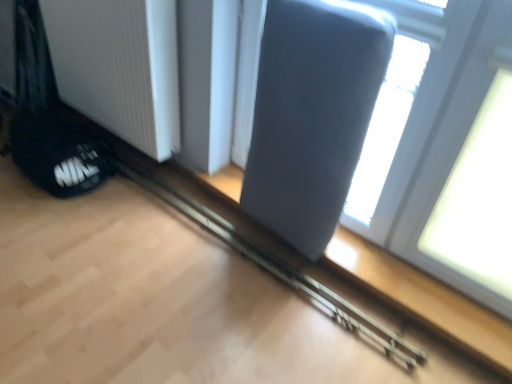
The height and width of the screenshot is (384, 512). I want to click on black mesh shoe at lower left, so click(59, 154).

In order to face black mesh shoe at lower left, should I rotate leftwards or rightwards?

Turn left by 25.802 degrees to look at black mesh shoe at lower left.

The image size is (512, 384). What do you see at coordinates (448, 151) in the screenshot? I see `matte gray cushion at upper right` at bounding box center [448, 151].

This screenshot has height=384, width=512. What do you see at coordinates (312, 114) in the screenshot? I see `suede gray swivel chair at upper right` at bounding box center [312, 114].

You are a GUI agent. You are given a task and a screenshot of the screen. Output one action in this format:
    pyautogui.click(x=<x>, y=<y>)
    Task: Click on the metallic gray rail at center
    
    Given the screenshot: What is the action you would take?
    pyautogui.click(x=275, y=265)

Locate an element on the screen. The width and height of the screenshot is (512, 384). swivel chair that appears on the right of black mesh shoe at lower left is located at coordinates (312, 114).

Consider the image. Which is more to the left, black mesh shoe at lower left or suede gray swivel chair at upper right?

black mesh shoe at lower left.

Which point is more forward, (101, 151) or (312, 75)?

The point (312, 75) is more forward.

Which is closer to the camera, (368, 335) or (422, 184)?

The point (422, 184) is closer to the camera.

Considering the sizes of objects metallic gray rail at center and matte gray cushion at upper right in the image provided, who is bigger, metallic gray rail at center or matte gray cushion at upper right?

matte gray cushion at upper right is bigger.

Is metallic gray rail at center located outside matte gray cushion at upper right?

Yes.

Locate an element on the screen. window above the metallic gray rail at center (from a real-world perspective) is located at coordinates (448, 151).

Is suede gray swivel chair at upper right taller than white ribbed radiator at lower left?

Correct, suede gray swivel chair at upper right is much taller as white ribbed radiator at lower left.

Is suede gray swivel chair at upper right wider or thinner than white ribbed radiator at lower left?

In the image, suede gray swivel chair at upper right appears to be wider than white ribbed radiator at lower left.

Locate an element on the screen. radiator above the suede gray swivel chair at upper right (from the image's perspective) is located at coordinates (119, 67).

Based on the photo, from a real-world perspective, which object rests below the other?

From a 3D spatial view, white ribbed radiator at lower left is below.

Between white ribbed radiator at lower left and suede gray swivel chair at upper right, which one is positioned behind?

white ribbed radiator at lower left is further away from the camera.

Between white ribbed radiator at lower left and suede gray swivel chair at upper right, which one has more height?

Standing taller between the two is suede gray swivel chair at upper right.

There is a white ribbed radiator at lower left. What are the coordinates of `swivel chair above it (from a real-world perspective)` in the screenshot? It's located at (312, 114).

Is the position of suede gray swivel chair at upper right more distant than that of metallic gray rail at center?

That is False.

From a real-world perspective, between suede gray swivel chair at upper right and metallic gray rail at center, who is vertically lower?

metallic gray rail at center.

Which is more to the right, suede gray swivel chair at upper right or metallic gray rail at center?

suede gray swivel chair at upper right.

From the image's perspective, is suede gray swivel chair at upper right located above metallic gray rail at center?

Yes, from the image's perspective, suede gray swivel chair at upper right is over metallic gray rail at center.

Between matte gray cushion at upper right and suede gray swivel chair at upper right, which one has larger width?

suede gray swivel chair at upper right.

How different are the orientations of matte gray cushion at upper right and suede gray swivel chair at upper right in degrees?

The facing directions of matte gray cushion at upper right and suede gray swivel chair at upper right are 0.575 degrees apart.

Does point (425, 168) come farther from viewer compared to point (346, 166)?

Yes, point (425, 168) is behind point (346, 166).

Is matte gray cushion at upper right shorter than suede gray swivel chair at upper right?

Incorrect, the height of matte gray cushion at upper right does not fall short of that of suede gray swivel chair at upper right.

Is metallic gray rail at center next to white ribbed radiator at lower left?

No, metallic gray rail at center is not next to white ribbed radiator at lower left.

Where is `radiator lying above the metallic gray rail at center (from the image's perspective)`? The width and height of the screenshot is (512, 384). radiator lying above the metallic gray rail at center (from the image's perspective) is located at coordinates (119, 67).

Which is less distant, (268,255) or (159,161)?

Point (268,255) appears to be closer to the viewer than point (159,161).

In the image, there is a suede gray swivel chair at upper right. Identify the location of footwear below it (from a real-world perspective). The image size is (512, 384). (59, 154).

The height and width of the screenshot is (384, 512). In order to click on rail below the matte gray cushion at upper right (from the image's perspective) in this screenshot , I will do `click(275, 265)`.

Looking at the image, which one is located closer to suede gray swivel chair at upper right, matte gray cushion at upper right or metallic gray rail at center?

matte gray cushion at upper right lies closer to suede gray swivel chair at upper right than the other object.

Considering their positions, is metallic gray rail at center positioned closer to black mesh shoe at lower left than white ribbed radiator at lower left?

white ribbed radiator at lower left is positioned closer to the anchor black mesh shoe at lower left.

Considering their positions, is matte gray cushion at upper right positioned further to metallic gray rail at center than white ribbed radiator at lower left?

matte gray cushion at upper right is positioned further to the anchor metallic gray rail at center.

Considering their positions, is matte gray cushion at upper right positioned further to metallic gray rail at center than suede gray swivel chair at upper right?

The object further to metallic gray rail at center is matte gray cushion at upper right.

Based on their spatial positions, is suede gray swivel chair at upper right or metallic gray rail at center closer to black mesh shoe at lower left?

Among the two, metallic gray rail at center is located nearer to black mesh shoe at lower left.

From the image, which object appears to be nearer to metallic gray rail at center, white ribbed radiator at lower left or suede gray swivel chair at upper right?

suede gray swivel chair at upper right is closer to metallic gray rail at center.

Which object lies nearer to the anchor point suede gray swivel chair at upper right, white ribbed radiator at lower left or black mesh shoe at lower left?

white ribbed radiator at lower left lies closer to suede gray swivel chair at upper right than the other object.

Based on their spatial positions, is metallic gray rail at center or black mesh shoe at lower left closer to suede gray swivel chair at upper right?

metallic gray rail at center.

Where is `rail between white ribbed radiator at lower left and matte gray cushion at upper right from left to right`? The height and width of the screenshot is (384, 512). rail between white ribbed radiator at lower left and matte gray cushion at upper right from left to right is located at coordinates (275, 265).

This screenshot has width=512, height=384. I want to click on radiator between black mesh shoe at lower left and matte gray cushion at upper right, so click(119, 67).

This screenshot has width=512, height=384. Identify the location of rail located between white ribbed radiator at lower left and suede gray swivel chair at upper right in the left-right direction. (275, 265).

The height and width of the screenshot is (384, 512). Find the location of `swivel chair between black mesh shoe at lower left and matte gray cushion at upper right`. swivel chair between black mesh shoe at lower left and matte gray cushion at upper right is located at coordinates (312, 114).